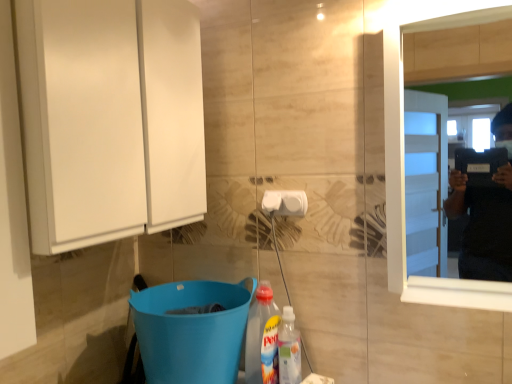
Question: Would you say white plastic towel bar at center is a long distance from translucent plastic bottle at lower center?

Choices:
 (A) yes
 (B) no

Answer: (B)

Question: Is white plastic towel bar at center touching translucent plastic bottle at lower center?

Choices:
 (A) yes
 (B) no

Answer: (B)

Question: Considering the relative sizes of white plastic towel bar at center and translucent plastic bottle at lower center in the image provided, is white plastic towel bar at center shorter than translucent plastic bottle at lower center?

Choices:
 (A) no
 (B) yes

Answer: (B)

Question: Considering the relative positions of white plastic towel bar at center and translucent plastic bottle at lower center in the image provided, is white plastic towel bar at center to the right of translucent plastic bottle at lower center from the viewer's perspective?

Choices:
 (A) yes
 (B) no

Answer: (B)

Question: Does white plastic towel bar at center have a greater height compared to translucent plastic bottle at lower center?

Choices:
 (A) yes
 (B) no

Answer: (B)

Question: Is translucent plastic bottle at lower center in front of or behind white plastic towel bar at center in the image?

Choices:
 (A) behind
 (B) front

Answer: (B)

Question: In terms of height, does translucent plastic bottle at lower center look taller or shorter compared to white plastic towel bar at center?

Choices:
 (A) short
 (B) tall

Answer: (B)

Question: From the image's perspective, is translucent plastic bottle at lower center above or below white plastic towel bar at center?

Choices:
 (A) below
 (B) above

Answer: (A)

Question: Is point (295, 337) positioned closer to the camera than point (283, 192)?

Choices:
 (A) farther
 (B) closer

Answer: (B)

Question: From a real-world perspective, relative to translucent plastic bottle at lower center, is white glossy cabinet at left vertically above or below?

Choices:
 (A) above
 (B) below

Answer: (A)

Question: Based on their positions, is white glossy cabinet at left located to the left or right of translucent plastic bottle at lower center?

Choices:
 (A) left
 (B) right

Answer: (A)

Question: Considering their positions, is white glossy cabinet at left located in front of or behind translucent plastic bottle at lower center?

Choices:
 (A) front
 (B) behind

Answer: (A)

Question: Considering the positions of white glossy cabinet at left and translucent plastic bottle at lower center in the image, is white glossy cabinet at left bigger or smaller than translucent plastic bottle at lower center?

Choices:
 (A) small
 (B) big

Answer: (B)

Question: Is white glossy cabinet at left taller or shorter than white wooden mirror at right?

Choices:
 (A) short
 (B) tall

Answer: (A)

Question: Visually, is white glossy cabinet at left positioned to the left or to the right of white wooden mirror at right?

Choices:
 (A) left
 (B) right

Answer: (A)